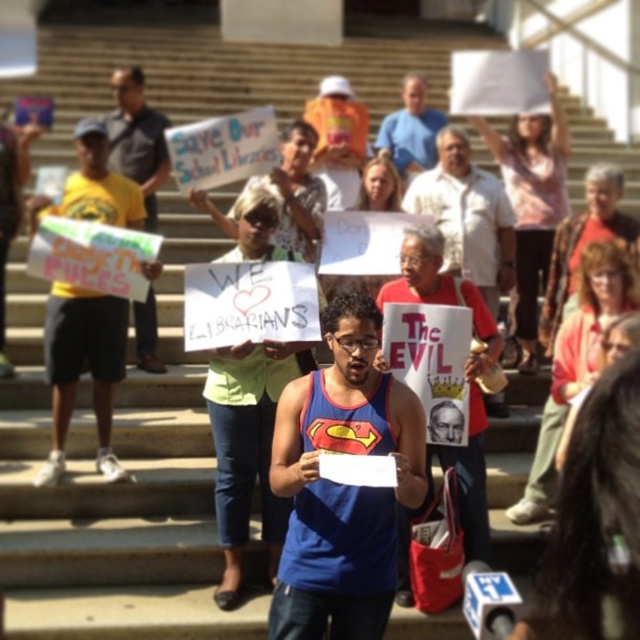
Between point (65, 200) and point (152, 346), which one is positioned in front?

Point (65, 200)

Does yellow cotton shirt at left have a greater height compared to yellow t-shirt at left?

Incorrect, yellow cotton shirt at left's height is not larger of yellow t-shirt at left's.

This screenshot has height=640, width=640. What are the coordinates of `yellow cotton shirt at left` in the screenshot? It's located at (83, 368).

Who is positioned more to the right, yellow cotton shirt at left or red fabric sign at center?

Positioned to the right is red fabric sign at center.

This screenshot has width=640, height=640. What are the coordinates of `yellow cotton shirt at left` in the screenshot? It's located at (83, 368).

Which is in front, point (120, 310) or point (460, 180)?

Point (120, 310) is more forward.

You are a GUI agent. You are given a task and a screenshot of the screen. Output one action in this format:
    pyautogui.click(x=<x>, y=<y>)
    Task: Click on the yellow cotton shirt at left
    This screenshot has height=640, width=640.
    Given the screenshot: What is the action you would take?
    pyautogui.click(x=83, y=368)

Find the location of a particular element. This screenshot has width=640, height=640. blue fabric tank top at center is located at coordinates (342, 484).

Which is behind, point (288, 627) or point (433, 129)?

The point (433, 129) is behind.

At what (x,y) coordinates should I click in order to perform the action: click on blue fabric tank top at center. Please return your answer as a coordinate pair (x, y). Image resolution: width=640 pixels, height=640 pixels. Looking at the image, I should click on (x=342, y=484).